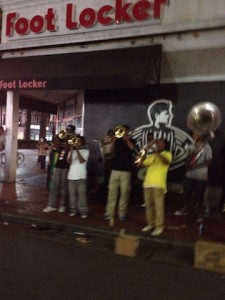
This screenshot has height=300, width=225. Find the location of `wooden box`. wooden box is located at coordinates (130, 242), (199, 255).